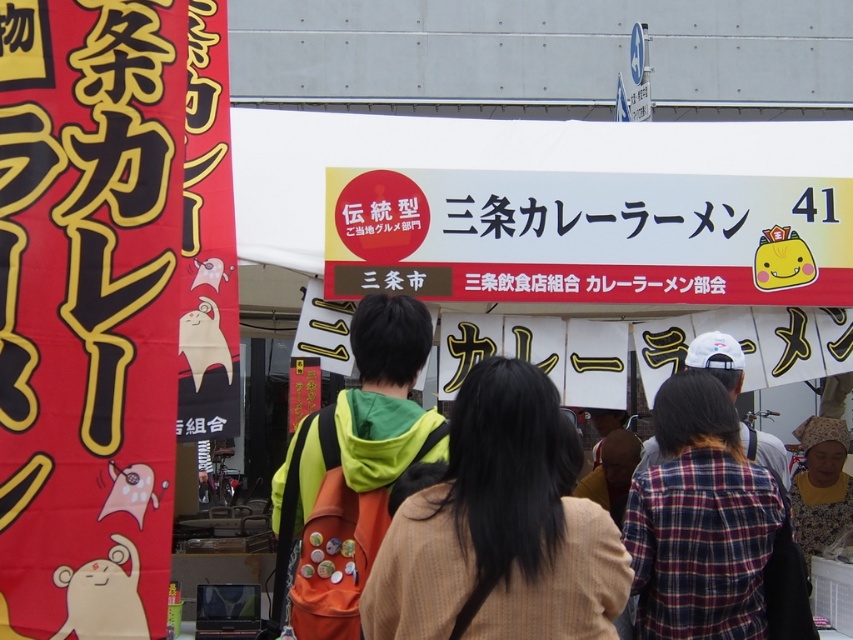
You are a festival attendee wearing both the brown textured coat at center and the plaid fabric shirt at center. If you want to store both items in a single bag, which one should you put in first to ensure both fit?

Since the brown textured coat at center occupies less space than the plaid fabric shirt at center, you should place the brown textured coat at center into the bag first, then the plaid fabric shirt at center on top to ensure both fit.

You are at a food festival and want to find the curry ramen stall. You see the red paper banner at left and the white paper sign at center. Which one is more to the left?

The red paper banner at left is more to the left than the white paper sign at center.

From the picture: You are a visitor at the festival and want to read the white paper sign at center. However, there is a green fabric jacket at center in your way. Can you see the sign without moving the jacket?

The white paper sign at center is above the green fabric jacket at center, so you can see the sign without moving the jacket.